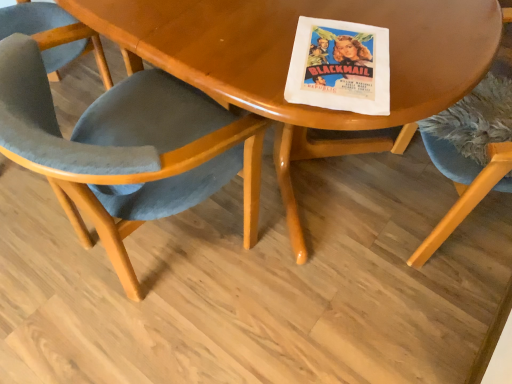
Question: Is wooden table at center not near velvet blue chair at right, marked as the first chair in a right-to-left arrangement?

Choices:
 (A) yes
 (B) no

Answer: (B)

Question: Is wooden table at center behind velvet blue chair at right, the second chair from the left?

Choices:
 (A) no
 (B) yes

Answer: (A)

Question: Could you tell me if wooden table at center is facing velvet blue chair at right, the second chair from the left?

Choices:
 (A) no
 (B) yes

Answer: (A)

Question: Is wooden table at center to the right of velvet blue chair at right, marked as the first chair in a right-to-left arrangement, from the viewer's perspective?

Choices:
 (A) no
 (B) yes

Answer: (A)

Question: Considering the relative sizes of wooden table at center and velvet blue chair at right, the second chair from the left, in the image provided, is wooden table at center wider than velvet blue chair at right, the second chair from the left,?

Choices:
 (A) yes
 (B) no

Answer: (A)

Question: Is velvet blue chair at right, the second chair from the left, in front of or behind velvet blue chair at center, acting as the first chair starting from the left, in the image?

Choices:
 (A) behind
 (B) front

Answer: (A)

Question: From a real-world perspective, is velvet blue chair at right, the second chair from the left, above or below velvet blue chair at center, acting as the first chair starting from the left?

Choices:
 (A) above
 (B) below

Answer: (A)

Question: Is velvet blue chair at right, the second chair from the left, to the left or to the right of velvet blue chair at center, acting as the 2th chair starting from the right, in the image?

Choices:
 (A) left
 (B) right

Answer: (B)

Question: Based on their sizes in the image, would you say velvet blue chair at right, the second chair from the left, is bigger or smaller than velvet blue chair at center, acting as the first chair starting from the left?

Choices:
 (A) small
 (B) big

Answer: (B)

Question: Is velvet blue chair at right, the second chair from the left, wider or thinner than wooden table at center?

Choices:
 (A) thin
 (B) wide

Answer: (A)

Question: Is velvet blue chair at right, marked as the first chair in a right-to-left arrangement, in front of or behind wooden table at center in the image?

Choices:
 (A) front
 (B) behind

Answer: (B)

Question: Is velvet blue chair at right, marked as the first chair in a right-to-left arrangement, to the left or to the right of wooden table at center in the image?

Choices:
 (A) right
 (B) left

Answer: (A)

Question: From a real-world perspective, is velvet blue chair at right, the second chair from the left, above or below wooden table at center?

Choices:
 (A) below
 (B) above

Answer: (B)

Question: Is velvet blue chair at center, acting as the 2th chair starting from the right, inside or outside of velvet blue chair at right, marked as the first chair in a right-to-left arrangement?

Choices:
 (A) outside
 (B) inside

Answer: (A)

Question: Considering the positions of point (120, 84) and point (443, 160), is point (120, 84) closer or farther from the camera than point (443, 160)?

Choices:
 (A) closer
 (B) farther

Answer: (B)